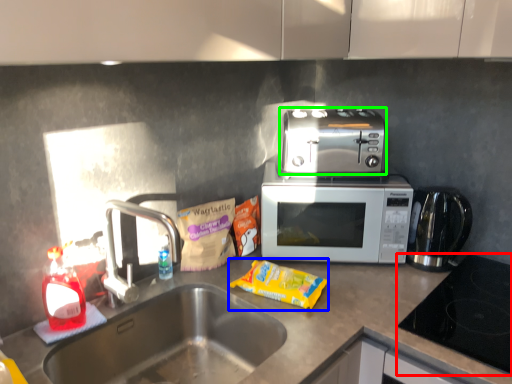
Question: Estimate the real-world distances between objects in this image. Which object is farther from gas stove (highlighted by a red box), snack (highlighted by a blue box) or toaster (highlighted by a green box)?

Choices:
 (A) snack
 (B) toaster

Answer: (B)